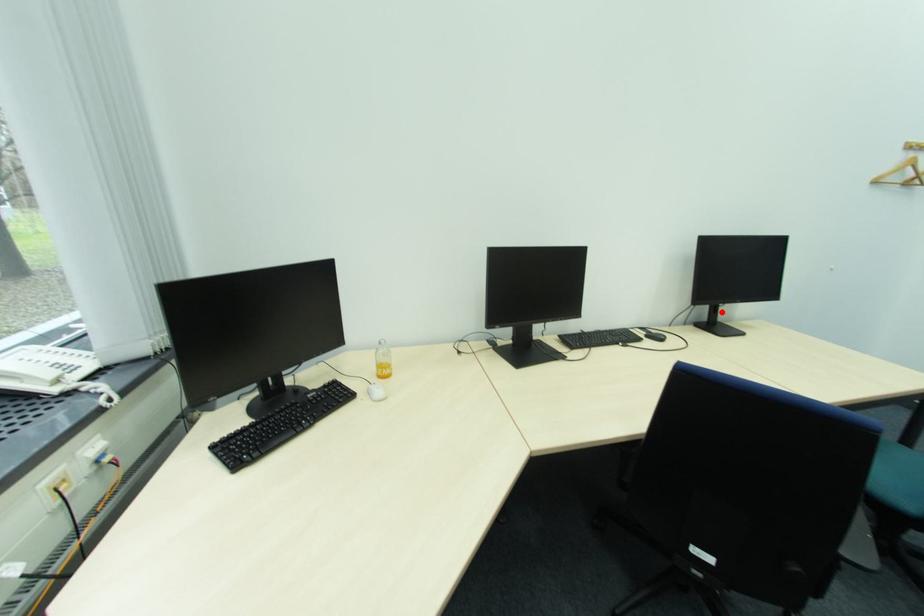
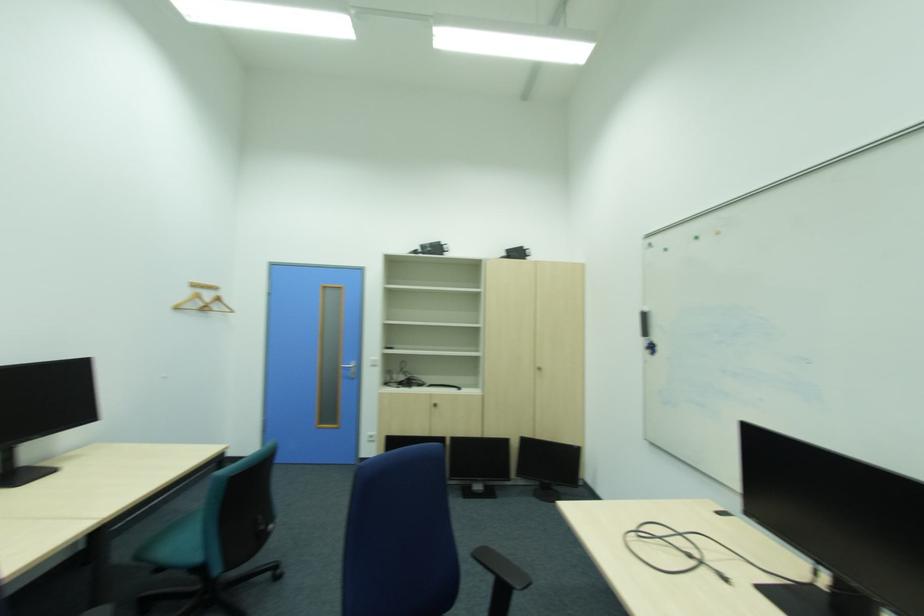
Question: I am providing you with two images of the same scene from different viewpoints. Image1 has a red point marked. In image2, the corresponding 3D location appears at what relative position? Reply with the corresponding letter.

Choices:
 (A) Closer
 (B) Farther

Answer: (A)